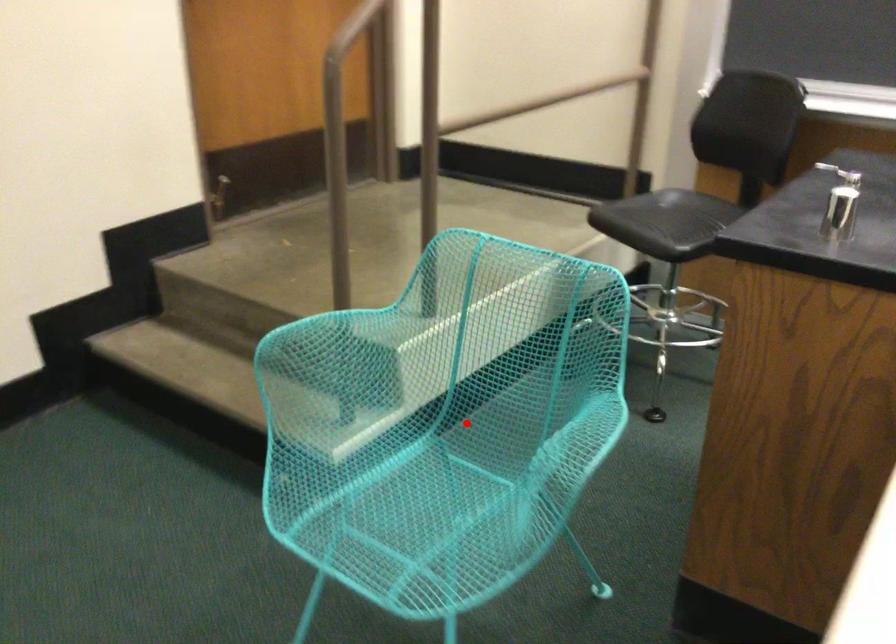
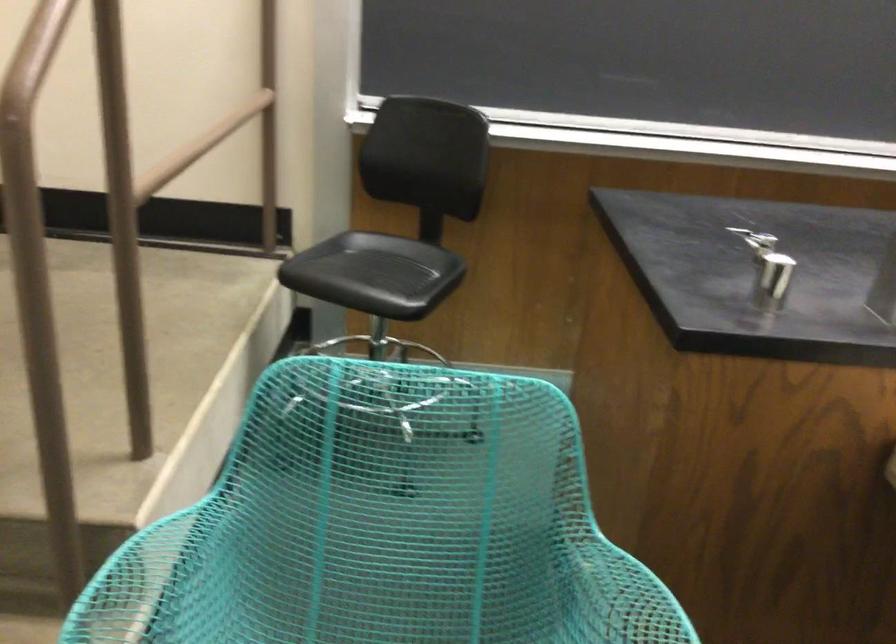
Find the pixel in the second image that matches the highlighted location in the first image.

(350, 619)